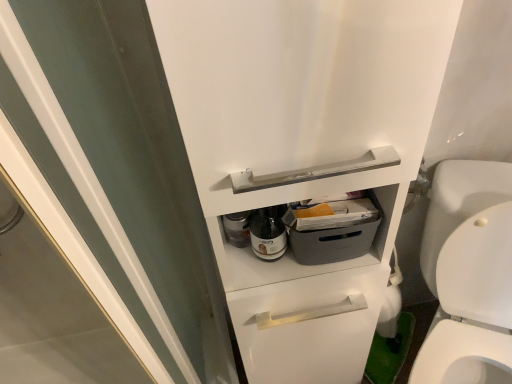
Question: Is white glossy toilet at right shorter than transparent glass screen door at upper left?

Choices:
 (A) no
 (B) yes

Answer: (B)

Question: Is white glossy toilet at right further to the viewer compared to transparent glass screen door at upper left?

Choices:
 (A) no
 (B) yes

Answer: (B)

Question: Does white glossy toilet at right have a smaller size compared to transparent glass screen door at upper left?

Choices:
 (A) no
 (B) yes

Answer: (A)

Question: Is white glossy toilet at right in front of transparent glass screen door at upper left?

Choices:
 (A) yes
 (B) no

Answer: (B)

Question: Considering the relative sizes of white glossy toilet at right and transparent glass screen door at upper left in the image provided, is white glossy toilet at right thinner than transparent glass screen door at upper left?

Choices:
 (A) yes
 (B) no

Answer: (B)

Question: Is white glossy toilet at right to the left or to the right of transparent glass screen door at upper left in the image?

Choices:
 (A) right
 (B) left

Answer: (A)

Question: From a real-world perspective, relative to transparent glass screen door at upper left, is white glossy toilet at right vertically above or below?

Choices:
 (A) above
 (B) below

Answer: (B)

Question: From the image's perspective, is white glossy toilet at right positioned above or below transparent glass screen door at upper left?

Choices:
 (A) above
 (B) below

Answer: (B)

Question: Looking at their shapes, would you say white glossy toilet at right is wider or thinner than transparent glass screen door at upper left?

Choices:
 (A) thin
 (B) wide

Answer: (B)

Question: Is white glossy toilet at right spatially inside translucent glass bottle at center, or outside of it?

Choices:
 (A) inside
 (B) outside

Answer: (B)

Question: From a real-world perspective, is white glossy toilet at right above or below translucent glass bottle at center?

Choices:
 (A) below
 (B) above

Answer: (A)

Question: In terms of width, does white glossy toilet at right look wider or thinner when compared to translucent glass bottle at center?

Choices:
 (A) thin
 (B) wide

Answer: (B)

Question: Is white glossy toilet at right to the left or to the right of translucent glass bottle at center in the image?

Choices:
 (A) left
 (B) right

Answer: (B)

Question: Considering their positions, is transparent glass screen door at upper left located in front of or behind translucent glass bottle at center?

Choices:
 (A) behind
 (B) front

Answer: (B)

Question: Is point (134, 167) positioned closer to the camera than point (276, 253)?

Choices:
 (A) closer
 (B) farther

Answer: (B)